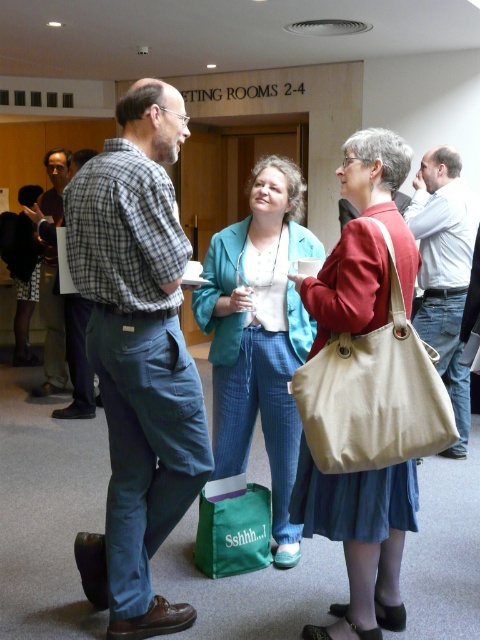
You are organizing a small event and need to place a 6.5 feet long table between the green canvas bag at lower center and the plaid shirt at left. Is there enough space to fit the table between them?

The distance between the green canvas bag at lower center and the plaid shirt at left is 7.26 feet, which is longer than the 6.5 feet table. Therefore, there is enough space to fit the table between them.